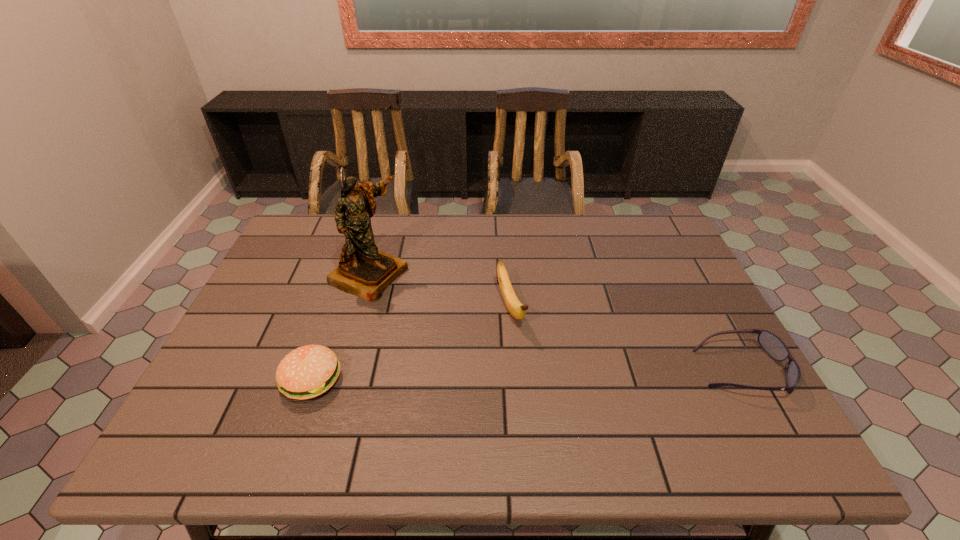
This screenshot has height=540, width=960. Identify the location of vacant space at the right edge. (704, 340).

In the image, there is a desktop. Identify the location of free space at the far left corner. (322, 232).

Where is `free point at the far right corner`? The height and width of the screenshot is (540, 960). free point at the far right corner is located at coordinates (639, 255).

I want to click on vacant area that lies between the patty and the figurine, so click(x=340, y=327).

Locate an element on the screen. The image size is (960, 540). vacant space in between the tallest object and the patty is located at coordinates (340, 327).

This screenshot has width=960, height=540. In order to click on free space between the figurine and the sunglasses in this screenshot , I will do `click(555, 322)`.

You are a GUI agent. You are given a task and a screenshot of the screen. Output one action in this format:
    pyautogui.click(x=<x>, y=<y>)
    Task: Click on the free space that is in between the figurine and the patty
    
    Given the screenshot: What is the action you would take?
    pyautogui.click(x=340, y=327)

This screenshot has height=540, width=960. Identify the location of free space between the tallest object and the sunglasses. (555, 322).

Locate an element on the screen. Image resolution: width=960 pixels, height=540 pixels. free space between the patty and the sunglasses is located at coordinates (526, 375).

Locate an element on the screen. The height and width of the screenshot is (540, 960). free space between the figurine and the rightmost object is located at coordinates (555, 322).